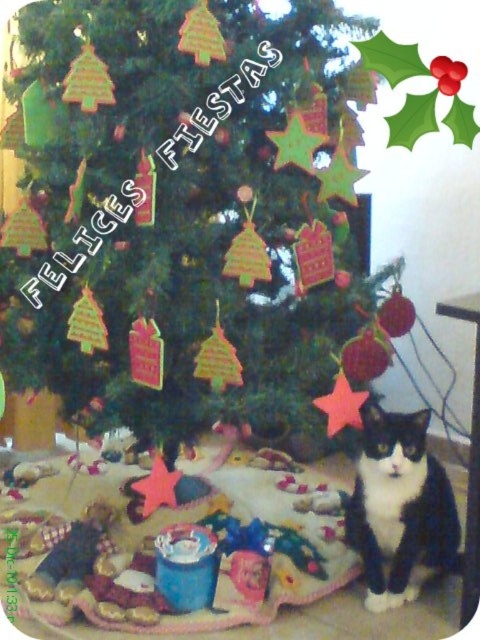
Can you confirm if green matte christmas tree at center is shorter than black and white fur cat at lower right?

In fact, green matte christmas tree at center may be taller than black and white fur cat at lower right.

How much distance is there between green matte christmas tree at center and black and white fur cat at lower right?

green matte christmas tree at center is 36.35 centimeters from black and white fur cat at lower right.

Is point (144, 330) positioned after point (424, 458)?

No, it is not.

In order to click on green matte christmas tree at center in this screenshot , I will do `click(189, 220)`.